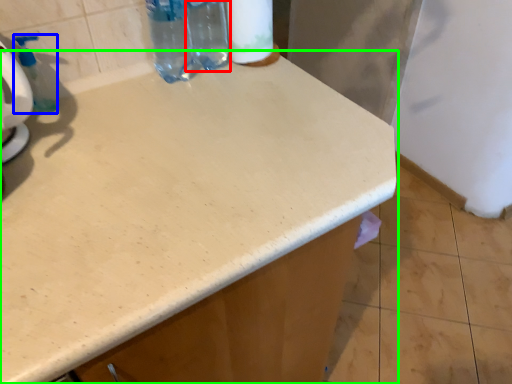
Question: Which object is the farthest from bottle (highlighted by a red box)? Choose among these: soap dispenser (highlighted by a blue box) or countertop (highlighted by a green box).

Choices:
 (A) soap dispenser
 (B) countertop

Answer: (B)